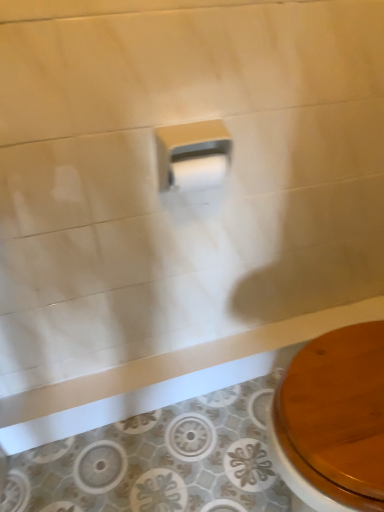
Question: Would you say white matte toilet paper at center, the second toilet paper in the bottom-to-top sequence, is inside or outside white glossy toilet paper at center, which ranks as the 2th toilet paper in top-to-bottom order?

Choices:
 (A) inside
 (B) outside

Answer: (B)

Question: Is white matte toilet paper at center, the second toilet paper in the bottom-to-top sequence, bigger or smaller than white glossy toilet paper at center, which ranks as the 2th toilet paper in top-to-bottom order?

Choices:
 (A) big
 (B) small

Answer: (A)

Question: Considering the positions of point (182, 140) and point (203, 158), is point (182, 140) closer or farther from the camera than point (203, 158)?

Choices:
 (A) farther
 (B) closer

Answer: (B)

Question: Considering the positions of white glossy toilet paper at center, which ranks as the 2th toilet paper in top-to-bottom order, and white matte toilet paper at center, which ranks as the first toilet paper in top-to-bottom order, in the image, is white glossy toilet paper at center, which ranks as the 2th toilet paper in top-to-bottom order, taller or shorter than white matte toilet paper at center, which ranks as the first toilet paper in top-to-bottom order,?

Choices:
 (A) tall
 (B) short

Answer: (B)

Question: From a real-world perspective, is white glossy toilet paper at center, placed as the first toilet paper when sorted from bottom to top, physically located above or below white matte toilet paper at center, the second toilet paper in the bottom-to-top sequence?

Choices:
 (A) above
 (B) below

Answer: (B)

Question: Does point (206, 182) appear closer or farther from the camera than point (208, 154)?

Choices:
 (A) closer
 (B) farther

Answer: (A)

Question: Considering the positions of white glossy toilet paper at center, placed as the first toilet paper when sorted from bottom to top, and white matte toilet paper at center, the second toilet paper in the bottom-to-top sequence, in the image, is white glossy toilet paper at center, placed as the first toilet paper when sorted from bottom to top, wider or thinner than white matte toilet paper at center, the second toilet paper in the bottom-to-top sequence,?

Choices:
 (A) wide
 (B) thin

Answer: (B)